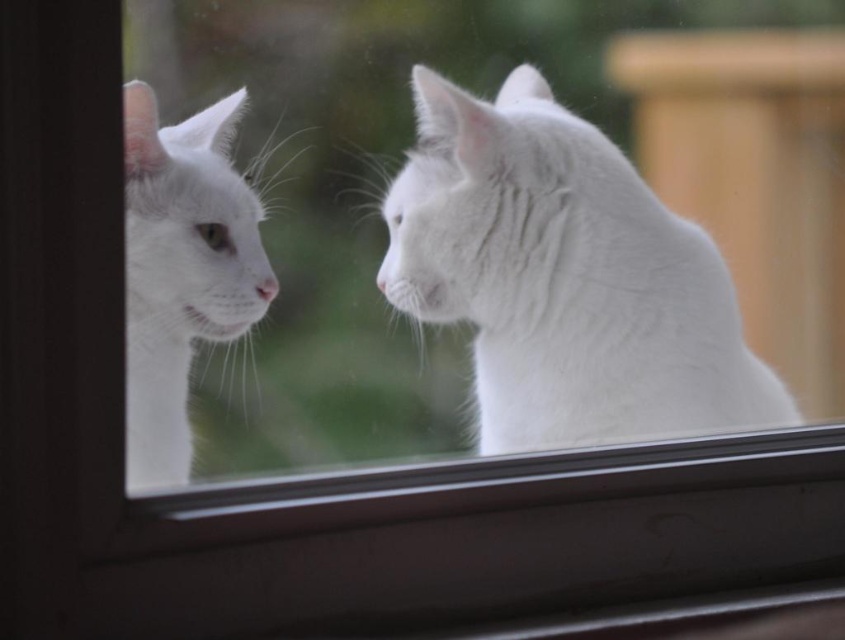
Can you confirm if white fluffy cat at center is positioned below white fluffy cat at left?

Yes.

This screenshot has height=640, width=845. In order to click on white fluffy cat at center in this screenshot , I will do `click(564, 276)`.

At what (x,y) coordinates should I click in order to perform the action: click on white fluffy cat at center. Please return your answer as a coordinate pair (x, y). Image resolution: width=845 pixels, height=640 pixels. Looking at the image, I should click on (564, 276).